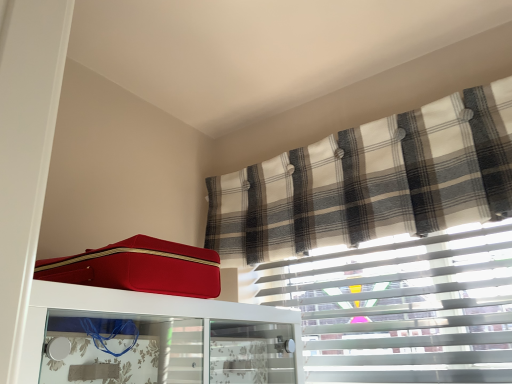
Question: Is plaid fabric curtain at upper right to the left of matte red suitcase at upper left from the viewer's perspective?

Choices:
 (A) yes
 (B) no

Answer: (B)

Question: Is plaid fabric curtain at upper right far from matte red suitcase at upper left?

Choices:
 (A) yes
 (B) no

Answer: (B)

Question: Can you confirm if plaid fabric curtain at upper right is thinner than matte red suitcase at upper left?

Choices:
 (A) yes
 (B) no

Answer: (A)

Question: Does plaid fabric curtain at upper right have a lesser height compared to matte red suitcase at upper left?

Choices:
 (A) yes
 (B) no

Answer: (B)

Question: From the image's perspective, would you say plaid fabric curtain at upper right is shown under matte red suitcase at upper left?

Choices:
 (A) no
 (B) yes

Answer: (A)

Question: Considering the relative sizes of plaid fabric curtain at upper right and matte red suitcase at upper left in the image provided, is plaid fabric curtain at upper right smaller than matte red suitcase at upper left?

Choices:
 (A) yes
 (B) no

Answer: (B)

Question: From a real-world perspective, is plaid fabric curtain at upper right positioned under matte red suitcase at upper left based on gravity?

Choices:
 (A) yes
 (B) no

Answer: (B)

Question: From the image's perspective, would you say plaid fabric curtain at upper right is shown under matte red suitcase at upper left?

Choices:
 (A) yes
 (B) no

Answer: (B)

Question: From the image's perspective, is plaid fabric curtain at upper right on matte red suitcase at upper left?

Choices:
 (A) no
 (B) yes

Answer: (B)

Question: Is plaid fabric curtain at upper right at the right side of matte red suitcase at upper left?

Choices:
 (A) yes
 (B) no

Answer: (A)

Question: Is plaid fabric curtain at upper right bigger than matte red suitcase at upper left?

Choices:
 (A) no
 (B) yes

Answer: (A)

Question: From a real-world perspective, is plaid fabric curtain at upper right physically above matte red suitcase at upper left?

Choices:
 (A) yes
 (B) no

Answer: (A)

Question: From the image's perspective, is matte red suitcase at upper left located beneath plaid fabric curtain at upper right?

Choices:
 (A) yes
 (B) no

Answer: (A)